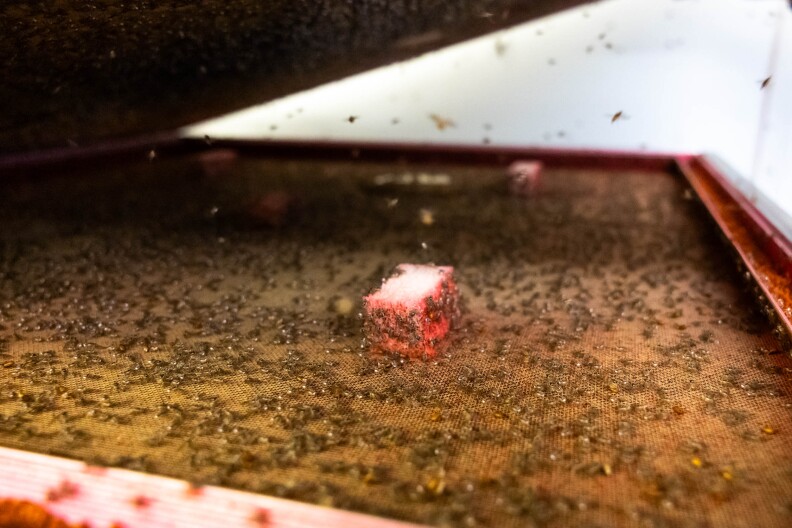
At what (x,y) coordinates should I click in order to perform the action: click on screen. Please return your answer as a coordinate pair (x, y). Looking at the image, I should click on pyautogui.click(x=716, y=431).